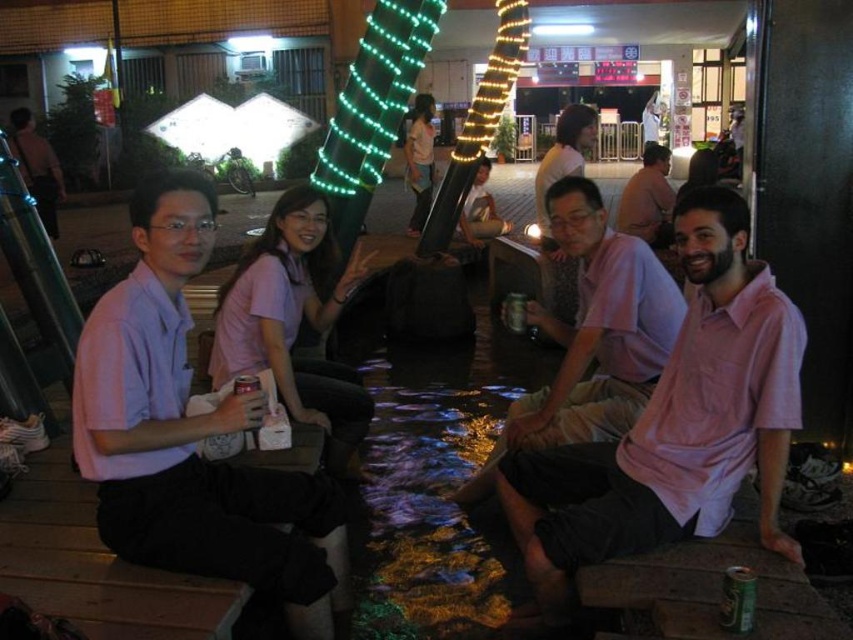
Question: Which of these objects is positioned farthest from the white matte can at center?

Choices:
 (A) green metallic can at center
 (B) matte pink shirt at left

Answer: (A)

Question: Considering the relative positions of matte pink shirt at center and green metallic can at lower right in the image provided, where is matte pink shirt at center located with respect to green metallic can at lower right?

Choices:
 (A) right
 (B) left

Answer: (B)

Question: Which of the following is the farthest from the observer?

Choices:
 (A) green metallic can at lower right
 (B) green metallic can at center
 (C) pink cotton shirt at center
 (D) white matte can at center

Answer: (B)

Question: Which point is farther to the camera?

Choices:
 (A) green metallic can at center
 (B) white matte can at center

Answer: (A)

Question: Can you confirm if matte pink shirt at center is positioned to the left of green metallic can at lower right?

Choices:
 (A) yes
 (B) no

Answer: (A)

Question: Does matte pink shirt at left have a lesser width compared to white matte can at center?

Choices:
 (A) no
 (B) yes

Answer: (A)